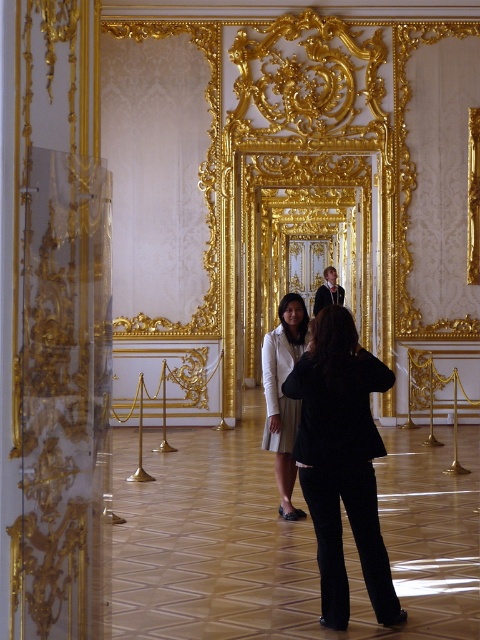
Is light beige fabric dress at center further to the viewer compared to smooth black suit at center?

No, light beige fabric dress at center is in front of smooth black suit at center.

Does point (302, 337) come in front of point (325, 301)?

Yes, point (302, 337) is in front of point (325, 301).

You are a GUI agent. You are given a task and a screenshot of the screen. Output one action in this format:
    pyautogui.click(x=<x>, y=<y>)
    Task: Click on the light beige fabric dress at center
    Image resolution: width=480 pixels, height=640 pixels.
    Given the screenshot: What is the action you would take?
    pyautogui.click(x=283, y=394)

What do you see at coordinates (342, 461) in the screenshot? I see `black fabric coat at center` at bounding box center [342, 461].

Does black fabric coat at center lie in front of light beige fabric dress at center?

Yes, black fabric coat at center is in front of light beige fabric dress at center.

Does point (322, 403) come closer to viewer compared to point (276, 376)?

Yes, it is in front of point (276, 376).

Where is `black fabric coat at center`? The height and width of the screenshot is (640, 480). black fabric coat at center is located at coordinates (342, 461).

Does black fabric coat at center lie in front of smooth black suit at center?

Yes, it is.

Can you confirm if black fabric coat at center is taller than smooth black suit at center?

Yes.

Find the location of a particular element. This screenshot has height=640, width=480. black fabric coat at center is located at coordinates (342, 461).